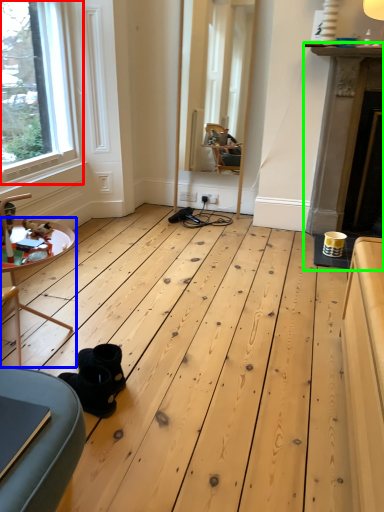
Question: Based on their relative distances, which object is nearer to window (highlighted by a red box)? Choose from table (highlighted by a blue box) and fireplace (highlighted by a green box).

Choices:
 (A) table
 (B) fireplace

Answer: (A)